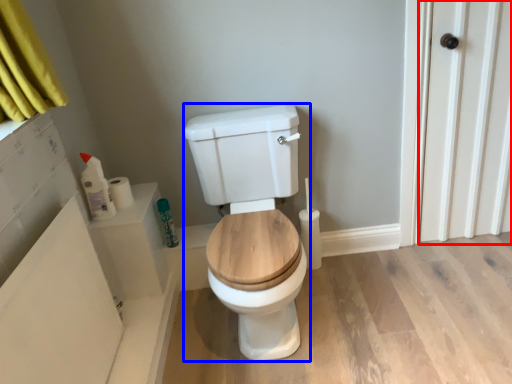
Question: Which of the following is the closest to the observer, screen door (highlighted by a red box) or porcelain (highlighted by a blue box)?

Choices:
 (A) screen door
 (B) porcelain

Answer: (B)